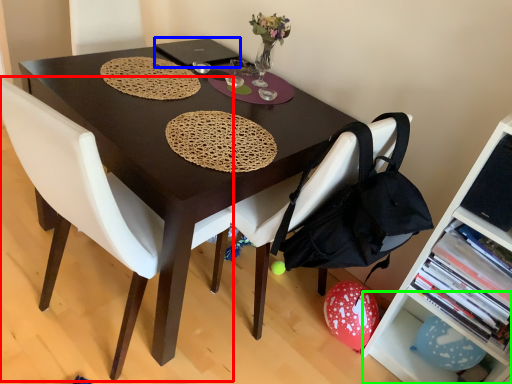
Question: Estimate the real-world distances between objects in this image. Which object is closer to chair (highlighted by a red box), laptop (highlighted by a blue box) or shelf (highlighted by a green box)?

Choices:
 (A) laptop
 (B) shelf

Answer: (A)